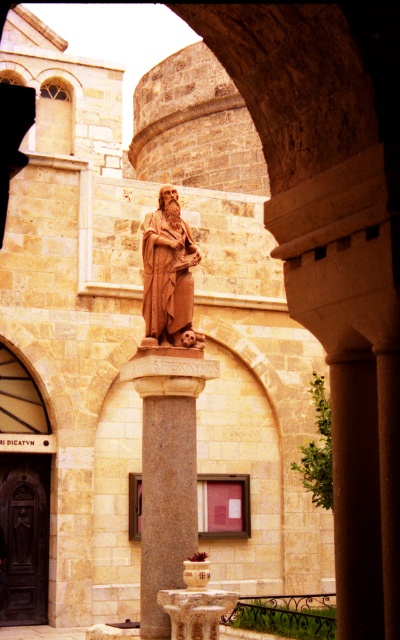
Who is positioned more to the left, granite column at center or brown stone statue at center?

Positioned to the left is brown stone statue at center.

Is granite column at center shorter than brown stone statue at center?

No.

Is point (172, 428) farther from camera compared to point (156, 314)?

No, (172, 428) is closer to viewer.

Identify the location of granite column at center. (166, 490).

Is granite column at center further to the viewer compared to white marble fountain at center?

Yes, it is.

Does granite column at center have a lesser height compared to white marble fountain at center?

No.

The image size is (400, 640). Describe the element at coordinates (166, 490) in the screenshot. I see `granite column at center` at that location.

Identify the location of granite column at center. (166, 490).

Can you confirm if brown stone statue at center is positioned above white marble fountain at center?

Correct, brown stone statue at center is located above white marble fountain at center.

Does brown stone statue at center have a lesser height compared to white marble fountain at center?

No, brown stone statue at center is not shorter than white marble fountain at center.

Is point (142, 252) positioned in front of point (202, 563)?

No, it is not.

Identify the location of brown stone statue at center. This screenshot has width=400, height=640. (168, 276).